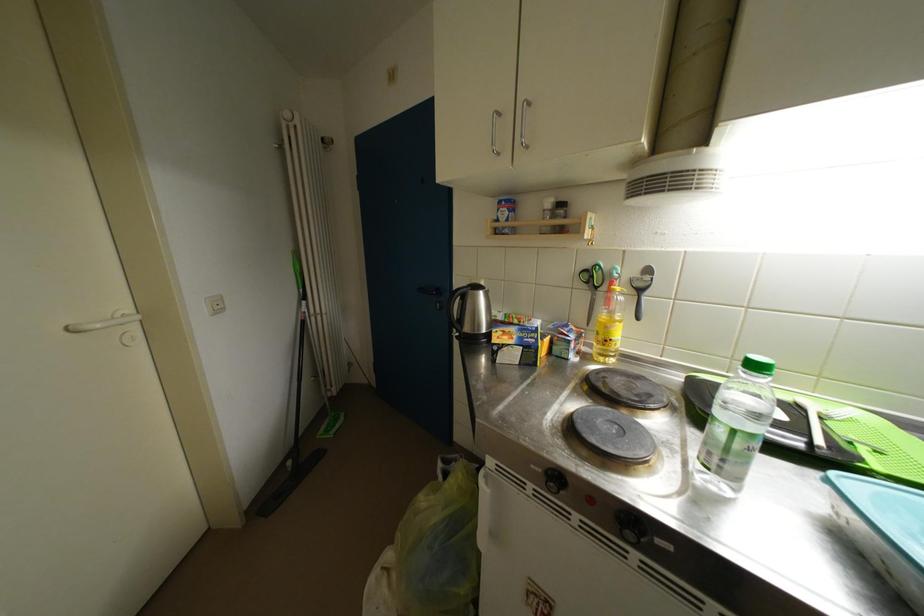
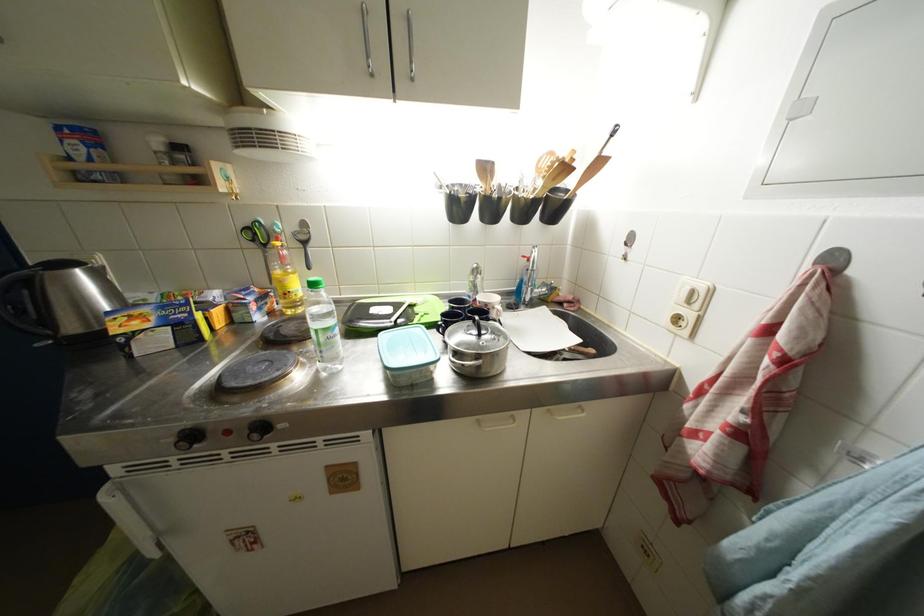
The point at (x=593, y=270) is marked in the first image. Where is the corresponding point in the second image?

(253, 227)